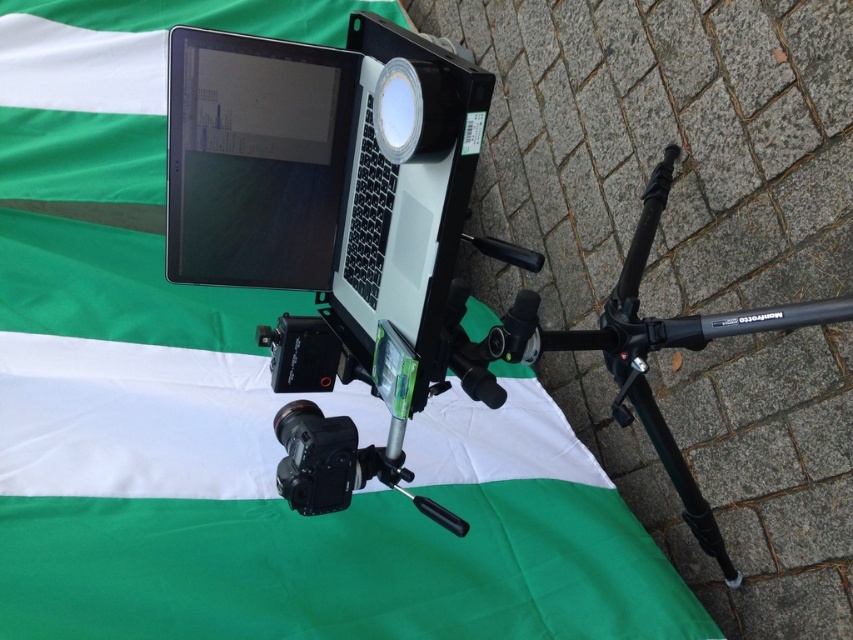
Question: Is matte black laptop at upper center smaller than black matte tripod at center?

Choices:
 (A) yes
 (B) no

Answer: (B)

Question: Does matte black laptop at upper center have a greater width compared to black matte tripod at center?

Choices:
 (A) no
 (B) yes

Answer: (B)

Question: Which object is closer to the camera taking this photo?

Choices:
 (A) black matte tripod at center
 (B) matte black laptop at upper center

Answer: (A)

Question: Is matte black laptop at upper center smaller than black matte tripod at center?

Choices:
 (A) no
 (B) yes

Answer: (A)

Question: Which object appears closest to the camera in this image?

Choices:
 (A) black matte tripod at center
 (B) matte black laptop at upper center

Answer: (A)

Question: Which point appears closest to the camera in this image?

Choices:
 (A) (608, 336)
 (B) (57, 4)

Answer: (A)